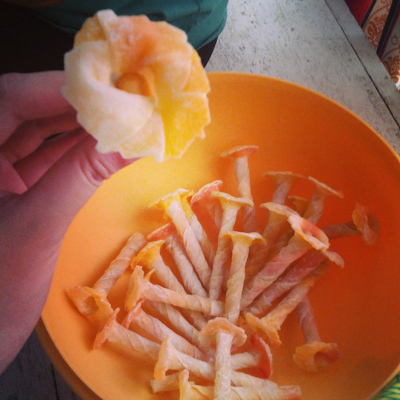
This screenshot has height=400, width=400. Identify the location of counter. (348, 71).